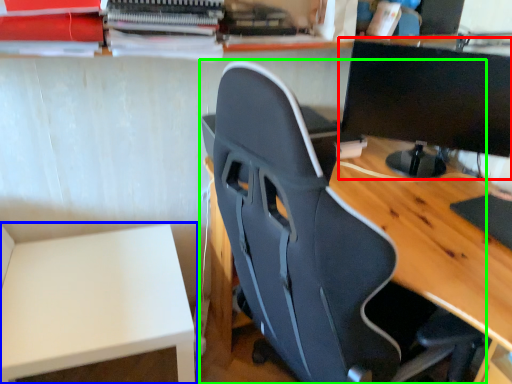
Question: Considering the real-world distances, which object is farthest from computer monitor (highlighted by a red box)? table (highlighted by a blue box) or chair (highlighted by a green box)?

Choices:
 (A) table
 (B) chair

Answer: (A)